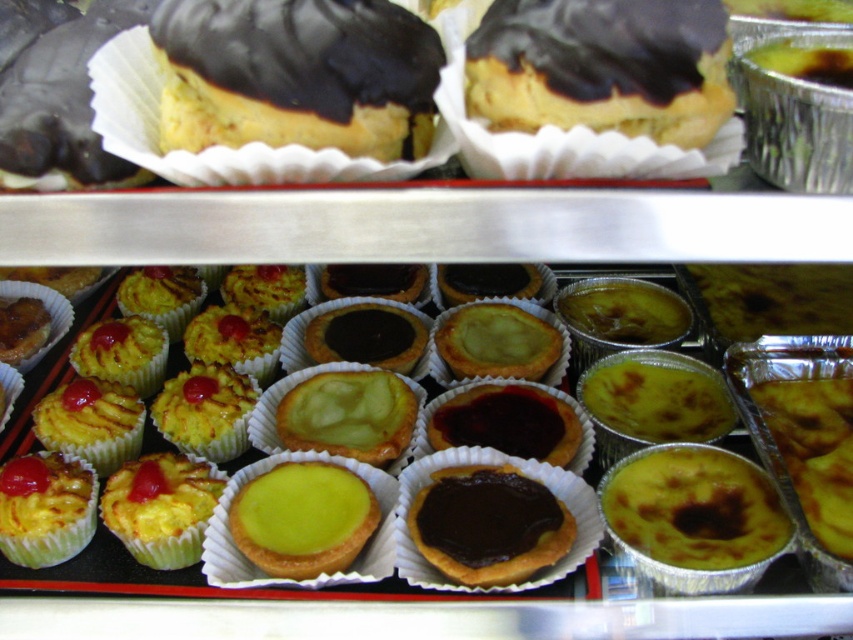
Question: Which object is closer to the camera taking this photo?

Choices:
 (A) chocolate matte tartlet at center
 (B) chocolate-coated pastry at center
 (C) chocolate-coated pastry at upper left
 (D) yellow matte tartlet at center

Answer: (B)

Question: Is chocolate matte tartlet at center thinner than lime green custard tartlet at center?

Choices:
 (A) no
 (B) yes

Answer: (A)

Question: Which object is the farthest from the chocolate-coated pastry at upper left?

Choices:
 (A) chocolate matte tartlet at center
 (B) yellow matte tartlet at center

Answer: (B)

Question: Which object is the farthest from the yellow matte tartlet at center?

Choices:
 (A) lime green custard tartlet at center
 (B) yellow cake with chocolate glaze at upper center
 (C) green matte tartlet at center
 (D) yellow glossy tartlet at lower left

Answer: (B)

Question: Is yellow matte tartlet at center bigger than lime green custard tartlet at center?

Choices:
 (A) yes
 (B) no

Answer: (A)

Question: Does yellow matte cupcake at lower left appear under yellow glossy tartlet at lower left?

Choices:
 (A) no
 (B) yes

Answer: (B)